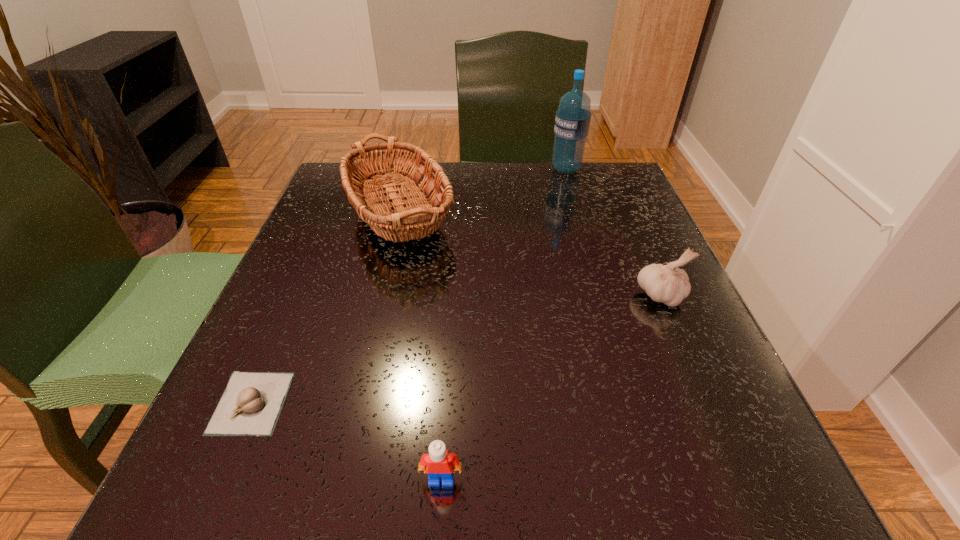
You are a GUI agent. You are given a task and a screenshot of the screen. Output one action in this format:
    pyautogui.click(x=<x>, y=<y>)
    Task: Click on the vacant area that lies between the fourth shortest object and the farther garlic
    The image size is (960, 540).
    Given the screenshot: What is the action you would take?
    pyautogui.click(x=529, y=259)

Where is `vacant area that lies between the tallest object and the shorter garlic`? vacant area that lies between the tallest object and the shorter garlic is located at coordinates (409, 286).

I want to click on free space between the Lego and the right garlic, so click(551, 387).

Locate an element on the screen. The image size is (960, 540). free space between the basket and the taller garlic is located at coordinates (529, 259).

In order to click on vacant point located between the fourth tallest object and the right garlic in this screenshot , I will do `click(551, 387)`.

Identify the location of free space between the taller garlic and the fourth shortest object. (529, 259).

Identify the location of free space between the farther garlic and the water bottle. (613, 232).

Find the location of a particular element. Image resolution: width=960 pixels, height=540 pixels. vacant area that lies between the taller garlic and the shorter garlic is located at coordinates (456, 349).

The height and width of the screenshot is (540, 960). I want to click on object that is the fourth closest to the shortest object, so 572,122.

Point out which object is positioned as the fourth nearest to the fourth object from left to right. Please provide its 2D coordinates. Your answer should be formatted as a tuple, i.e. [(x, y)], where the tuple contains the x and y coordinates of a point satisfying the conditions above.

[(439, 462)]